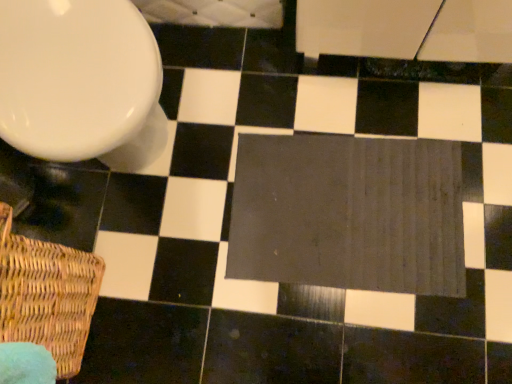
Question: Is dark gray fabric bath mat at center further to camera compared to white glossy toilet at upper left?

Choices:
 (A) yes
 (B) no

Answer: (A)

Question: Does dark gray fabric bath mat at center have a greater width compared to white glossy toilet at upper left?

Choices:
 (A) no
 (B) yes

Answer: (A)

Question: Does dark gray fabric bath mat at center have a lesser width compared to white glossy toilet at upper left?

Choices:
 (A) yes
 (B) no

Answer: (A)

Question: From a real-world perspective, is dark gray fabric bath mat at center physically above white glossy toilet at upper left?

Choices:
 (A) no
 (B) yes

Answer: (A)

Question: Is dark gray fabric bath mat at center in front of white glossy toilet at upper left?

Choices:
 (A) no
 (B) yes

Answer: (A)

Question: Are dark gray fabric bath mat at center and white glossy toilet at upper left located far from each other?

Choices:
 (A) no
 (B) yes

Answer: (A)

Question: Could you tell me if white glossy toilet at upper left is facing dark gray fabric bath mat at center?

Choices:
 (A) no
 (B) yes

Answer: (A)

Question: Is white glossy toilet at upper left at the right side of dark gray fabric bath mat at center?

Choices:
 (A) yes
 (B) no

Answer: (B)

Question: From the image's perspective, does white glossy toilet at upper left appear higher than dark gray fabric bath mat at center?

Choices:
 (A) yes
 (B) no

Answer: (A)

Question: From a real-world perspective, is white glossy toilet at upper left physically above dark gray fabric bath mat at center?

Choices:
 (A) no
 (B) yes

Answer: (B)

Question: Does white glossy toilet at upper left appear on the left side of dark gray fabric bath mat at center?

Choices:
 (A) no
 (B) yes

Answer: (B)

Question: From the image's perspective, is white glossy toilet at upper left beneath dark gray fabric bath mat at center?

Choices:
 (A) no
 (B) yes

Answer: (A)

Question: Does dark gray fabric bath mat at center have a greater height compared to woven brown basket at lower left?

Choices:
 (A) yes
 (B) no

Answer: (B)